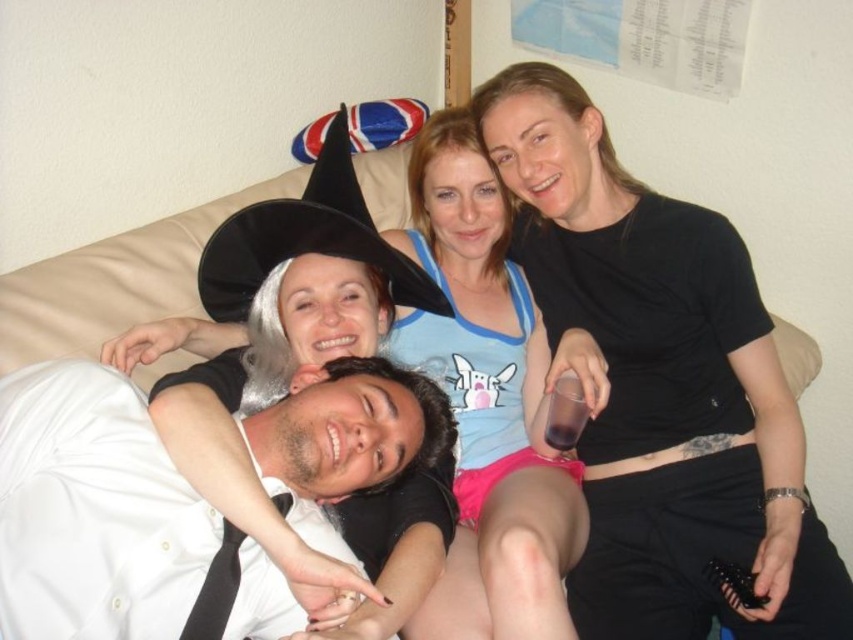
Question: Which point is closer to the camera?

Choices:
 (A) black matte shirt at upper right
 (B) matte black witch hat at upper center
 (C) white glossy shirt at lower left

Answer: (C)

Question: Which object appears closest to the camera in this image?

Choices:
 (A) black matte shirt at upper right
 (B) white glossy shirt at lower left
 (C) matte black witch hat at upper center
 (D) light blue cotton tank top at center

Answer: (B)

Question: Is black matte shirt at upper right smaller than matte black witch hat at upper center?

Choices:
 (A) yes
 (B) no

Answer: (A)

Question: Where is white glossy shirt at lower left located in relation to light blue cotton tank top at center in the image?

Choices:
 (A) left
 (B) right

Answer: (A)

Question: Does matte black witch hat at upper center appear on the right side of white glossy shirt at lower left?

Choices:
 (A) no
 (B) yes

Answer: (B)

Question: Estimate the real-world distances between objects in this image. Which object is closer to the white glossy shirt at lower left?

Choices:
 (A) light blue cotton tank top at center
 (B) matte black witch hat at upper center
 (C) black matte shirt at upper right

Answer: (B)